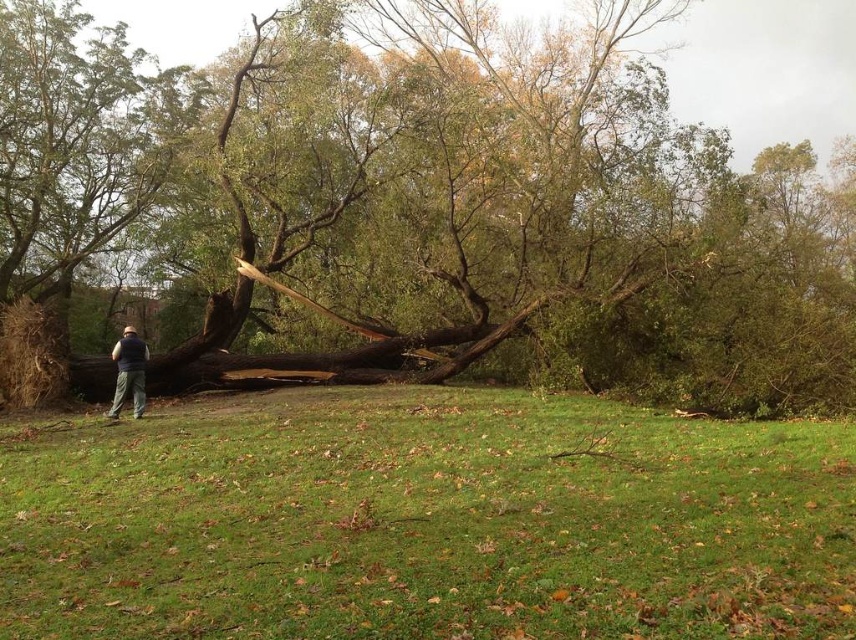
Can you confirm if brown rough wood at center is wider than dark blue vest at lower left?

Yes, brown rough wood at center is wider than dark blue vest at lower left.

Can you confirm if brown rough wood at center is positioned to the left of dark blue vest at lower left?

Incorrect, brown rough wood at center is not on the left side of dark blue vest at lower left.

Identify the location of brown rough wood at center. Image resolution: width=856 pixels, height=640 pixels. (415, 204).